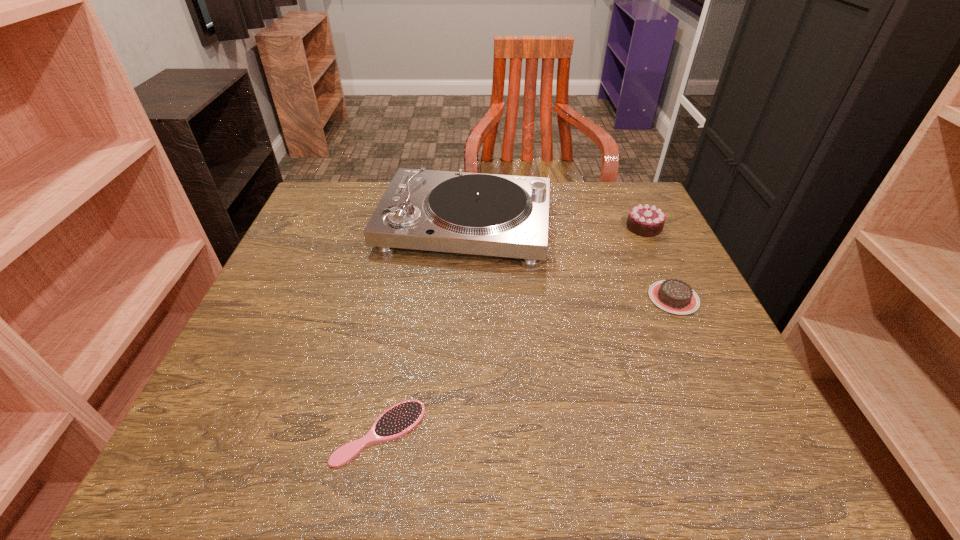
Where is `record player`? record player is located at coordinates (458, 212).

Identify the location of the taller chocolate cake. Image resolution: width=960 pixels, height=540 pixels. (644, 220).

Image resolution: width=960 pixels, height=540 pixels. I want to click on the second tallest object, so click(644, 220).

I want to click on the shorter chocolate cake, so click(x=675, y=296).

Find the location of a particular element. The height and width of the screenshot is (540, 960). the nearer chocolate cake is located at coordinates (675, 296).

Where is `the shortest object`? the shortest object is located at coordinates (398, 420).

Find the location of a particular element. This screenshot has height=540, width=960. the nearest object is located at coordinates (398, 420).

Image resolution: width=960 pixels, height=540 pixels. Find the location of `vacant space located on the right of the tallest object`. vacant space located on the right of the tallest object is located at coordinates (663, 225).

Identify the location of vacant position located on the front of the third shortest object. The image size is (960, 540). (696, 339).

The height and width of the screenshot is (540, 960). Find the location of `vacant region located 0.320m on the left of the nearer chocolate cake`. vacant region located 0.320m on the left of the nearer chocolate cake is located at coordinates (496, 298).